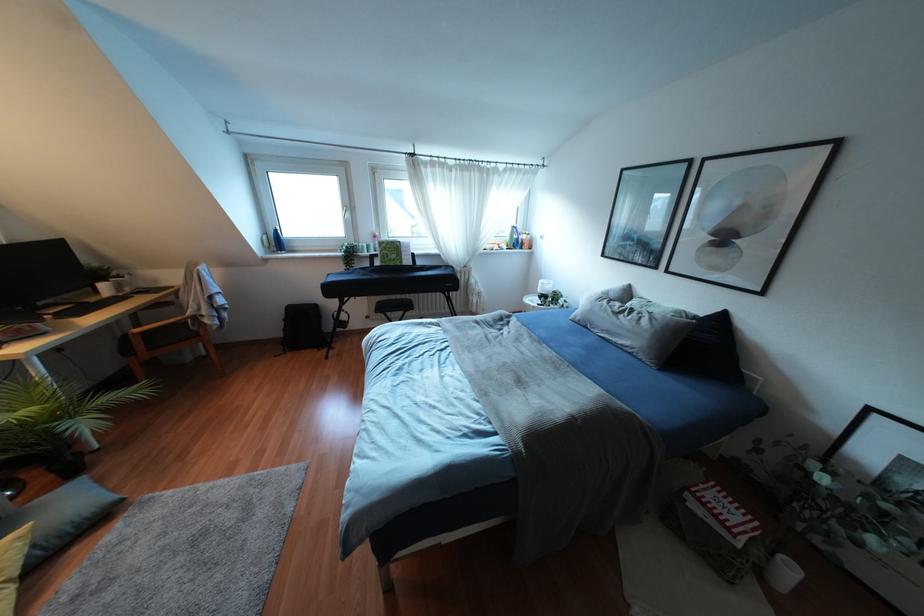
This screenshot has width=924, height=616. What do you see at coordinates (393, 307) in the screenshot?
I see `the black chair seat` at bounding box center [393, 307].